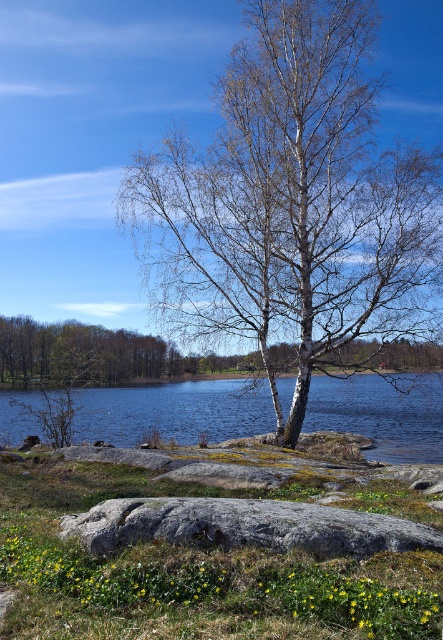
Based on the photo, you are standing in front of the birch tree and want to throw a stone into the water. Which object, the clear blue water at center or the brown bark tree at center, is closer to you?

The clear blue water at center is closer to the viewer than the brown bark tree at center, so you should aim for the water as it is nearer.